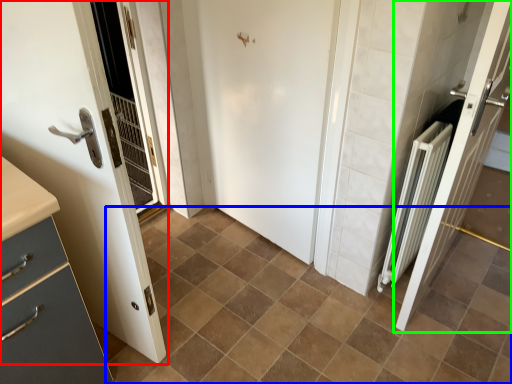
Question: Considering the real-world distances, which object is farthest from door (highlighted by a red box)? ceramic tile (highlighted by a blue box) or door (highlighted by a green box)?

Choices:
 (A) ceramic tile
 (B) door

Answer: (B)